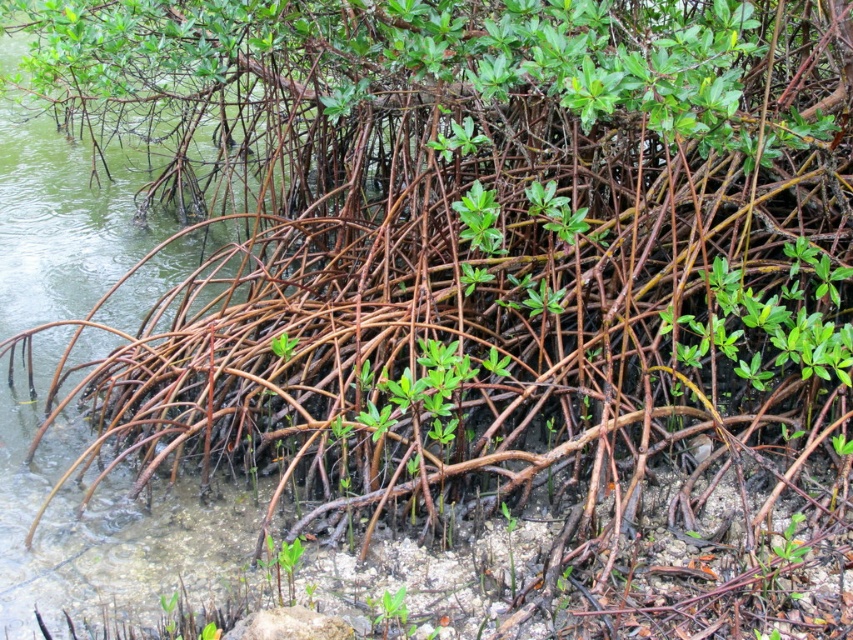
You are navigating through the mangrove roots and want to reach the point at the bottom right of the image. Which of the two points, point (468, 214) or point (373, 621), is closer to your current position if you are standing at the center of the image?

Point (373, 621) is closer to the center of the image than point (468, 214) because it is positioned lower and to the right, making it nearer to the bottom right direction from the center.

You are standing on a wooden boardwalk observing the green matte leaves at center in the mangrove roots. Your friend is holding a measuring tape and asks if the distance from your current position to the leaves is within a 10 feet safety zone for photography. Can you confirm?

The green matte leaves at center is 7.71 feet away from viewer, so yes, the distance is within the 10 feet safety zone for photography.